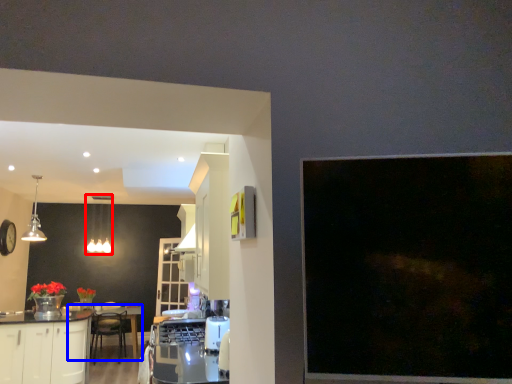
Question: Which of the following is the farthest to the observer, lighting (highlighted by a red box) or round table (highlighted by a blue box)?

Choices:
 (A) lighting
 (B) round table

Answer: (A)